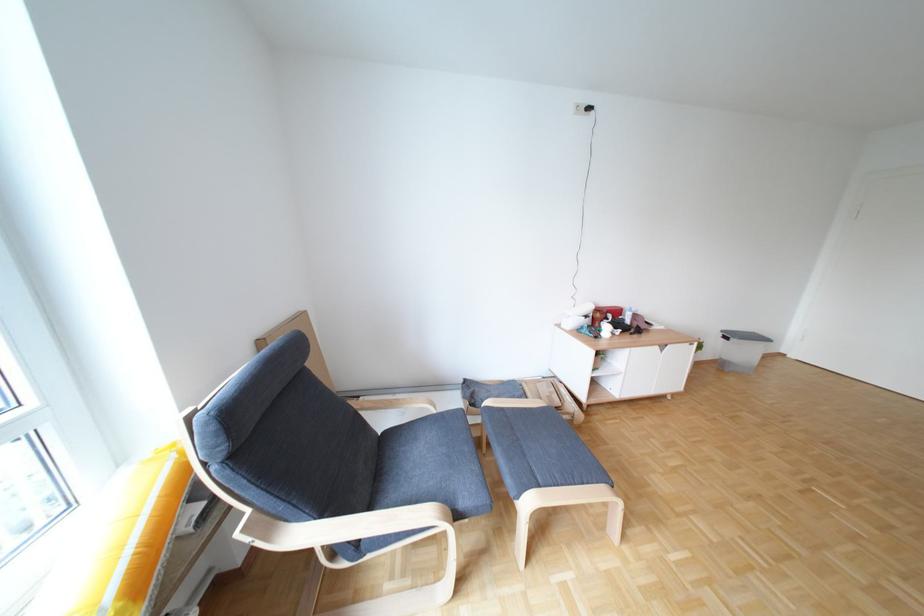
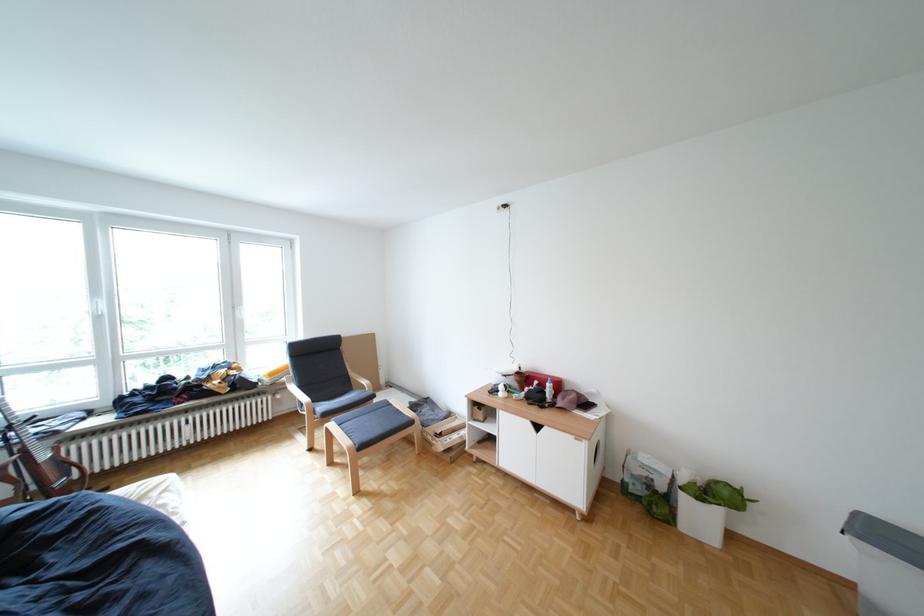
Question: I am providing you with two images of the same scene from different viewpoints. Which of the following objects are not visible in image2?

Choices:
 (A) brown acoustic guitar
 (B) cardboard box
 (C) cabinet door handle
 (D) none of these

Answer: (D)